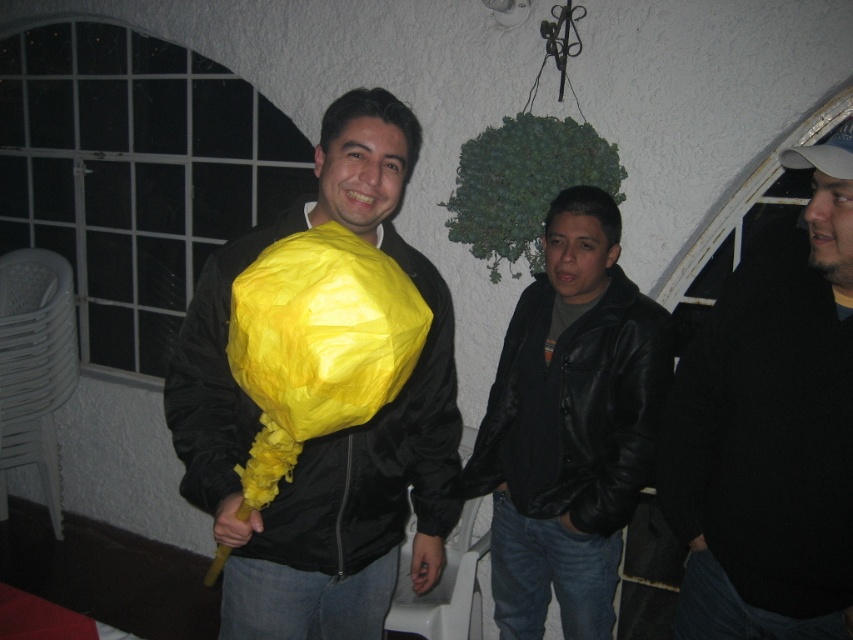
Is dark gray knit sweater at right taller than black leather jacket at center?

Yes.

Who is positioned more to the left, dark gray knit sweater at right or black leather jacket at center?

black leather jacket at center is more to the left.

Locate an element on the screen. dark gray knit sweater at right is located at coordinates (770, 428).

Find the location of a particular element. This screenshot has height=640, width=853. dark gray knit sweater at right is located at coordinates (770, 428).

Consider the image. Which of these two, matte yellow paper fan at center or dark gray knit sweater at right, stands shorter?

With less height is dark gray knit sweater at right.

Is matte yellow paper fan at center smaller than dark gray knit sweater at right?

Indeed, matte yellow paper fan at center has a smaller size compared to dark gray knit sweater at right.

Who is more forward, (224, 529) or (672, 403)?

Point (224, 529) is in front.

The image size is (853, 640). I want to click on matte yellow paper fan at center, so click(x=328, y=435).

Can you confirm if matte yellow paper fan at center is shorter than black leather jacket at center?

No.

Does point (387, 540) lie behind point (605, 477)?

No, (387, 540) is in front of (605, 477).

Where is `matte yellow paper fan at center`? This screenshot has height=640, width=853. matte yellow paper fan at center is located at coordinates (328, 435).